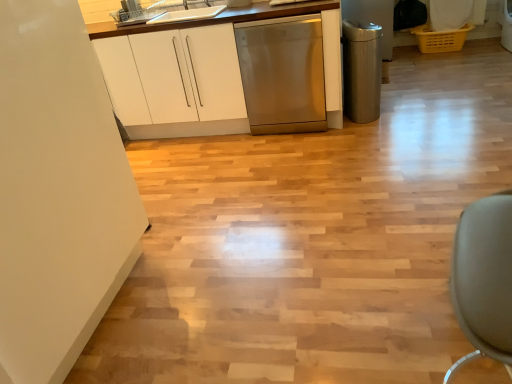
Question: Can you confirm if polished stainless steel trash can at right, the second appliance positioned from the left, is smaller than white glossy sink at upper center?

Choices:
 (A) yes
 (B) no

Answer: (B)

Question: Is polished stainless steel trash can at right, the second appliance positioned from the left, taller than white glossy sink at upper center?

Choices:
 (A) no
 (B) yes

Answer: (B)

Question: Considering the relative sizes of polished stainless steel trash can at right, the first appliance viewed from the right, and white glossy sink at upper center in the image provided, is polished stainless steel trash can at right, the first appliance viewed from the right, thinner than white glossy sink at upper center?

Choices:
 (A) no
 (B) yes

Answer: (B)

Question: Is polished stainless steel trash can at right, which appears as the 2th appliance when viewed from the top, turned away from white glossy sink at upper center?

Choices:
 (A) yes
 (B) no

Answer: (A)

Question: Would you say polished stainless steel trash can at right, the second appliance positioned from the left, is outside white glossy sink at upper center?

Choices:
 (A) yes
 (B) no

Answer: (A)

Question: Considering the positions of white glossy sink at upper center and white glossy cabinet at upper left in the image, is white glossy sink at upper center wider or thinner than white glossy cabinet at upper left?

Choices:
 (A) wide
 (B) thin

Answer: (B)

Question: Is white glossy sink at upper center bigger or smaller than white glossy cabinet at upper left?

Choices:
 (A) big
 (B) small

Answer: (B)

Question: In terms of height, does white glossy sink at upper center look taller or shorter compared to white glossy cabinet at upper left?

Choices:
 (A) short
 (B) tall

Answer: (A)

Question: From a real-world perspective, is white glossy sink at upper center positioned above or below white glossy cabinet at upper left?

Choices:
 (A) above
 (B) below

Answer: (A)

Question: In terms of height, does white glossy cabinet at upper left look taller or shorter compared to metallic dishwasher at upper center, the 2th appliance from the right?

Choices:
 (A) short
 (B) tall

Answer: (B)

Question: Would you say white glossy cabinet at upper left is inside or outside metallic dishwasher at upper center, arranged as the first appliance when viewed from the left?

Choices:
 (A) inside
 (B) outside

Answer: (B)

Question: Based on their sizes in the image, would you say white glossy cabinet at upper left is bigger or smaller than metallic dishwasher at upper center, the 2th appliance from the right?

Choices:
 (A) big
 (B) small

Answer: (A)

Question: In the image, is white glossy cabinet at upper left positioned in front of or behind metallic dishwasher at upper center, the 2th appliance positioned from the bottom?

Choices:
 (A) behind
 (B) front

Answer: (B)

Question: Would you say metallic dishwasher at upper center, marked as the 1th appliance in a top-to-bottom arrangement, is inside or outside polished stainless steel trash can at right, the second appliance positioned from the left?

Choices:
 (A) outside
 (B) inside

Answer: (A)

Question: Visually, is metallic dishwasher at upper center, the 2th appliance positioned from the bottom, positioned to the left or to the right of polished stainless steel trash can at right, the second appliance positioned from the left?

Choices:
 (A) right
 (B) left

Answer: (B)